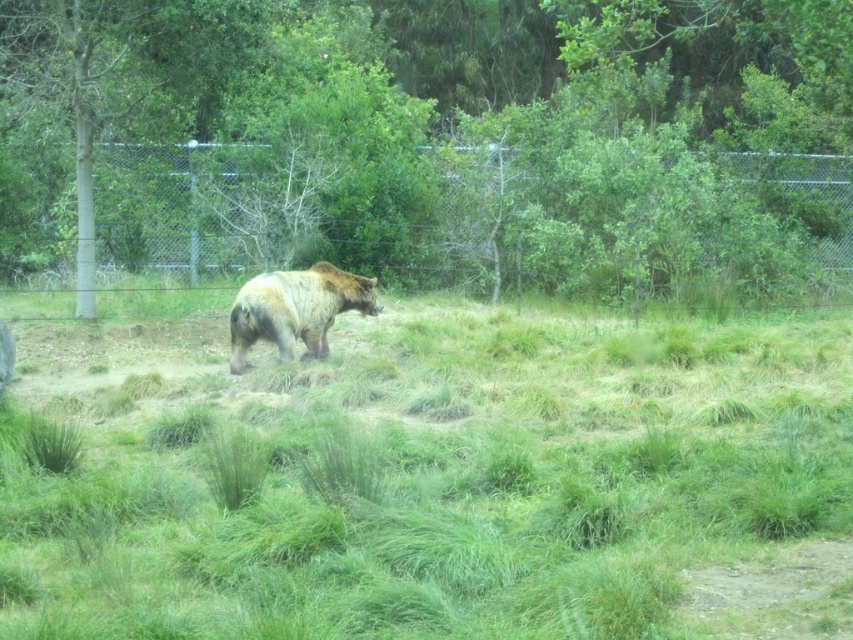
Who is positioned more to the left, brown textured tree at center or brown furry bear at center?

brown furry bear at center

Is point (482, 97) positioned in front of point (310, 285)?

No, it is behind (310, 285).

Between point (801, 166) and point (281, 289), which one is positioned in front?

Point (281, 289) is more forward.

In order to click on brown textured tree at center in this screenshot , I will do `click(428, 141)`.

Locate an element on the screen. This screenshot has height=640, width=853. green grassy at center is located at coordinates (x=434, y=477).

Does green grassy at center appear on the left side of brown furry bear at center?

In fact, green grassy at center is to the right of brown furry bear at center.

Who is more distant from viewer, (x=122, y=406) or (x=271, y=336)?

The point (x=271, y=336) is behind.

Find the location of a particular element. Image resolution: width=853 pixels, height=640 pixels. green grassy at center is located at coordinates click(x=434, y=477).

Is point (398, 621) closer to viewer compared to point (345, 268)?

Yes, it is.

Find the location of a particular element. green grassy at center is located at coordinates pos(434,477).